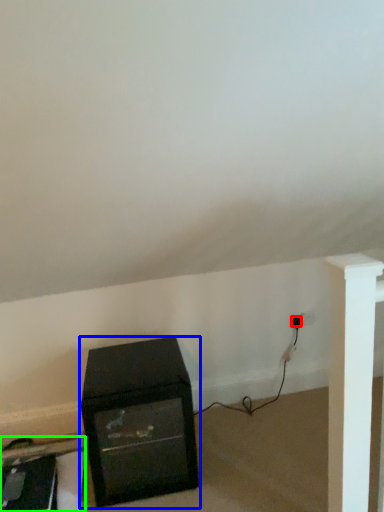
Question: Based on their relative distances, which object is farther from plug (highlighted by a red box)? Choose from furniture (highlighted by a blue box) and furniture (highlighted by a green box).

Choices:
 (A) furniture
 (B) furniture

Answer: (B)